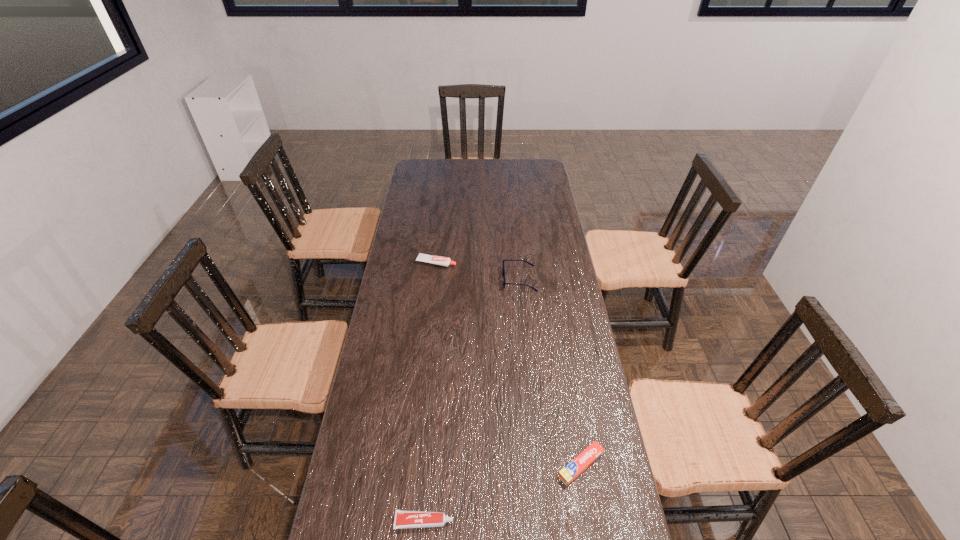
You are a GUI agent. You are given a task and a screenshot of the screen. Output one action in this format:
    pyautogui.click(x=<x>, y=<y>)
    Task: Click on the vacant space located at the nozzle of the nearest toothpaste
    
    Given the screenshot: What is the action you would take?
    pyautogui.click(x=513, y=522)

Where is `free space located on the back of the second nearest object`? The height and width of the screenshot is (540, 960). free space located on the back of the second nearest object is located at coordinates (570, 404).

The width and height of the screenshot is (960, 540). I want to click on spectacles at the right edge, so click(x=503, y=260).

Where is `toothpaste located in the right edge section of the desktop`? This screenshot has width=960, height=540. toothpaste located in the right edge section of the desktop is located at coordinates (571, 471).

In the image, there is a desktop. Where is `vacant space at the far edge`? This screenshot has height=540, width=960. vacant space at the far edge is located at coordinates (492, 160).

Find the location of a particular element. The height and width of the screenshot is (540, 960). vacant space at the left edge of the desktop is located at coordinates (371, 348).

The width and height of the screenshot is (960, 540). Identify the location of vacant space at the right edge of the desktop. click(x=549, y=237).

At what (x,y) coordinates should I click in order to perform the action: click on vacant space at the far left corner of the desktop. Please return your answer as a coordinate pair (x, y). The width and height of the screenshot is (960, 540). Looking at the image, I should click on (434, 164).

Find the location of `free location at the far right corner of the desktop`. free location at the far right corner of the desktop is located at coordinates (546, 167).

Where is `vacant space in between the third farthest object and the tallest toothpaste`? The image size is (960, 540). vacant space in between the third farthest object and the tallest toothpaste is located at coordinates (509, 363).